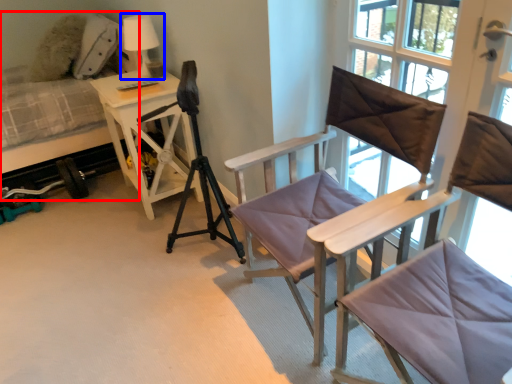
Question: Which of the following is the closest to the observer, hospital bed (highlighted by a red box) or table lamp (highlighted by a blue box)?

Choices:
 (A) hospital bed
 (B) table lamp

Answer: (A)